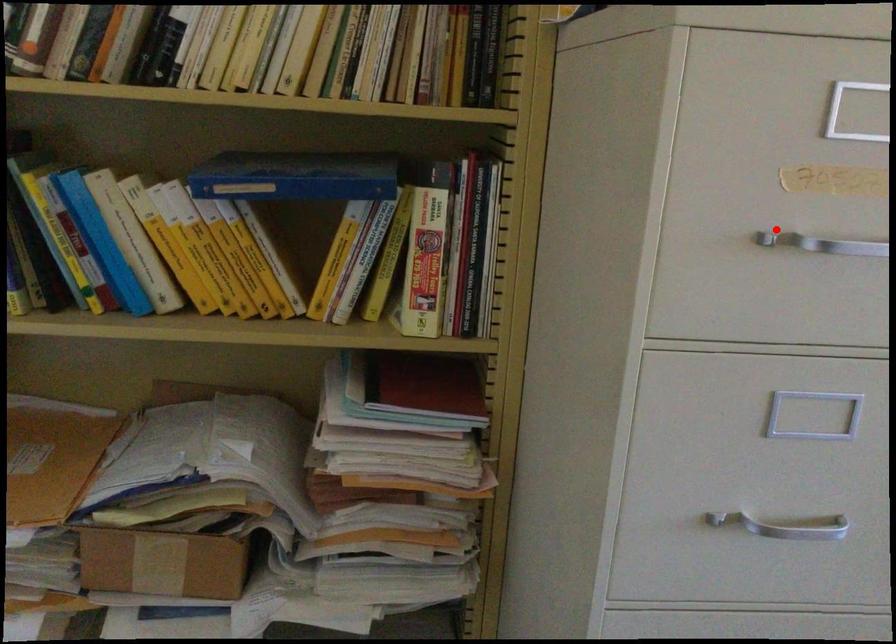
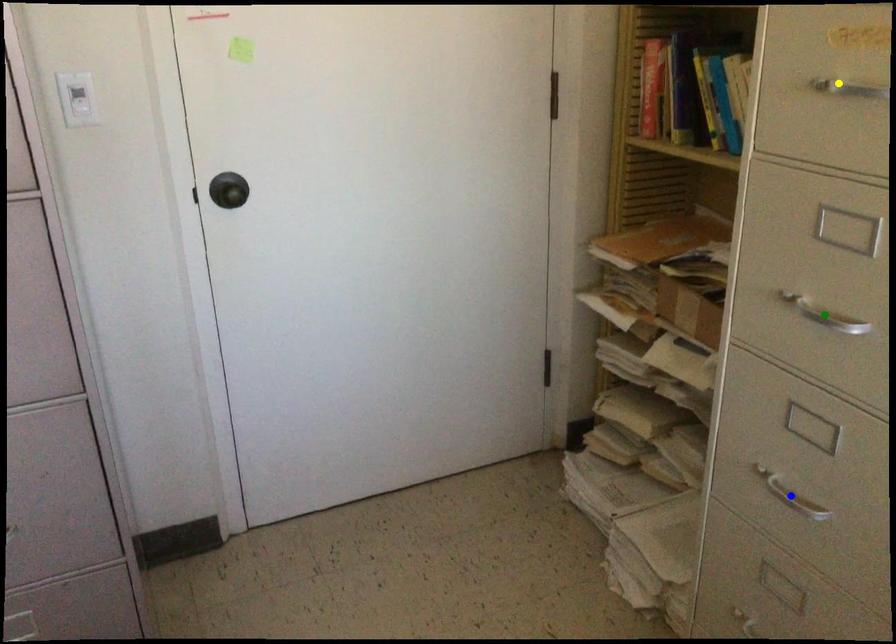
Question: I am providing you with two images of the same scene from different viewpoints. A red point is marked on the first image. You are given multiple points on the second image. Which spot in image 2 lines up with the point in image 1?

Choices:
 (A) blue point
 (B) yellow point
 (C) green point

Answer: (B)